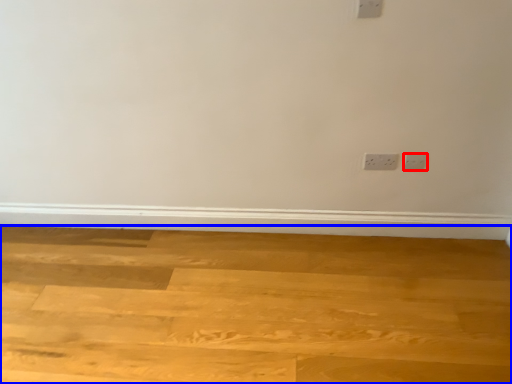
Question: Which point is further to the camera, power plugs and sockets (highlighted by a red box) or plywood (highlighted by a blue box)?

Choices:
 (A) power plugs and sockets
 (B) plywood

Answer: (A)